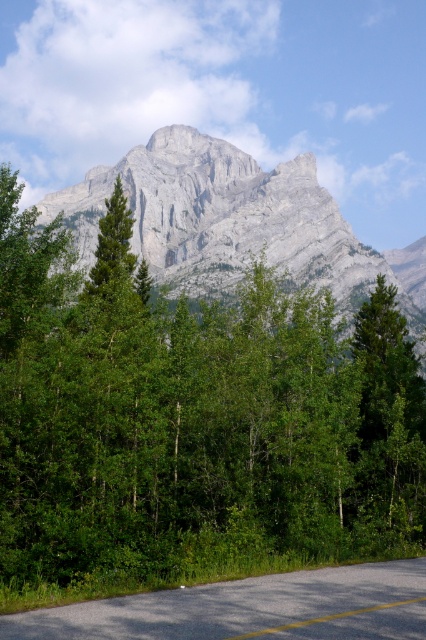
Between green leafy tree at center and gray asphalt road at center, which one has less height?

gray asphalt road at center is shorter.

Is green leafy tree at center above gray asphalt road at center?

Yes.

The width and height of the screenshot is (426, 640). In order to click on green leafy tree at center in this screenshot , I will do `click(192, 419)`.

Measure the distance between green leafy tree at center and gray rock mountain at upper center.

green leafy tree at center and gray rock mountain at upper center are 99.07 meters apart.

Which is in front, point (120, 358) or point (314, 182)?

Point (120, 358)

Where is `green leafy tree at center`? This screenshot has width=426, height=640. green leafy tree at center is located at coordinates (192, 419).

How distant is gray rock mountain at upper center from gray asphalt road at center?

gray rock mountain at upper center is 222.74 meters from gray asphalt road at center.

The image size is (426, 640). In order to click on gray rock mountain at upper center in this screenshot , I will do `click(235, 224)`.

What do you see at coordinates (235, 224) in the screenshot? This screenshot has width=426, height=640. I see `gray rock mountain at upper center` at bounding box center [235, 224].

The width and height of the screenshot is (426, 640). In order to click on gray rock mountain at upper center in this screenshot , I will do `click(235, 224)`.